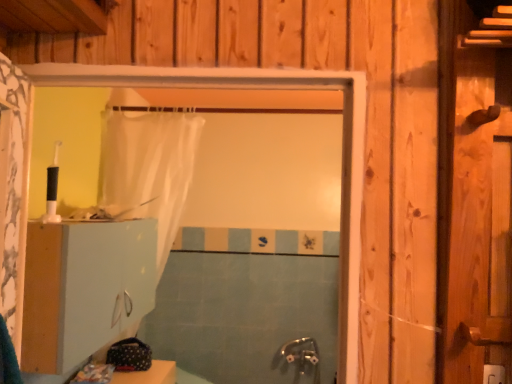
What do you see at coordinates (84, 289) in the screenshot?
I see `white matte cabinet at lower left` at bounding box center [84, 289].

What is the approximate height of white matte cabinet at lower left?

It is 16.42 inches.

Identify the location of translucent white shower curtain at center. (149, 169).

Looking at this image, is blue tile bath at center positioned before white matte cabinet at lower left?

No.

In order to click on dresser in front of the blue tile bath at center in this screenshot , I will do `click(84, 289)`.

Which of these two, blue tile bath at center or white matte cabinet at lower left, is bigger?

white matte cabinet at lower left.

Does point (298, 333) come in front of point (34, 227)?

No, it is not.

Which object is further away from the camera, blue tile bath at center or translucent white shower curtain at center?

blue tile bath at center is further from the camera.

Is blue tile bath at center at the right side of translucent white shower curtain at center?

Yes, blue tile bath at center is to the right of translucent white shower curtain at center.

Who is bigger, blue tile bath at center or translucent white shower curtain at center?

With larger size is translucent white shower curtain at center.

Considering the relative sizes of blue tile bath at center and translucent white shower curtain at center in the image provided, is blue tile bath at center shorter than translucent white shower curtain at center?

Correct, blue tile bath at center is not as tall as translucent white shower curtain at center.

Between translucent white shower curtain at center and white matte cabinet at lower left, which one has smaller width?

Thinner between the two is white matte cabinet at lower left.

From a real-world perspective, is translucent white shower curtain at center above or below white matte cabinet at lower left?

In terms of real-world spatial position, translucent white shower curtain at center is above white matte cabinet at lower left.

Can you confirm if translucent white shower curtain at center is positioned to the right of white matte cabinet at lower left?

Yes.

Considering the relative positions of translucent white shower curtain at center and white matte cabinet at lower left in the image provided, is translucent white shower curtain at center behind white matte cabinet at lower left?

Yes, it is behind white matte cabinet at lower left.

Does translucent white shower curtain at center appear on the left side of blue tile bath at center?

Yes, translucent white shower curtain at center is to the left of blue tile bath at center.

From a real-world perspective, is translucent white shower curtain at center physically above blue tile bath at center?

Yes.

From the image's perspective, which one is positioned higher, white matte cabinet at lower left or translucent white shower curtain at center?

white matte cabinet at lower left is shown above in the image.

Is white matte cabinet at lower left thinner than translucent white shower curtain at center?

Yes, white matte cabinet at lower left is thinner than translucent white shower curtain at center.

In the scene shown: Which object is positioned more to the right, white matte cabinet at lower left or translucent white shower curtain at center?

translucent white shower curtain at center is more to the right.

Are white matte cabinet at lower left and translucent white shower curtain at center far apart?

white matte cabinet at lower left is near translucent white shower curtain at center, not far away.

Based on the photo, from the image's perspective, is white matte cabinet at lower left on top of blue tile bath at center?

Yes.

Based on their sizes in the image, would you say white matte cabinet at lower left is bigger or smaller than blue tile bath at center?

Clearly, white matte cabinet at lower left is larger in size than blue tile bath at center.

Is the depth of white matte cabinet at lower left greater than that of blue tile bath at center?

That is False.

From a real-world perspective, is white matte cabinet at lower left physically located above or below blue tile bath at center?

white matte cabinet at lower left is above blue tile bath at center.

Image resolution: width=512 pixels, height=384 pixels. Find the location of `bath located behind the white matte cabinet at lower left`. bath located behind the white matte cabinet at lower left is located at coordinates (244, 315).

Identify the location of bath below the translucent white shower curtain at center (from a real-world perspective). (244, 315).

Looking at this image, considering their positions, is white matte cabinet at lower left positioned further to blue tile bath at center than translucent white shower curtain at center?

white matte cabinet at lower left is further to blue tile bath at center.

Which object lies further to the anchor point white matte cabinet at lower left, translucent white shower curtain at center or blue tile bath at center?

blue tile bath at center is positioned further to the anchor white matte cabinet at lower left.

Looking at the image, which one is located closer to translucent white shower curtain at center, blue tile bath at center or white matte cabinet at lower left?

white matte cabinet at lower left lies closer to translucent white shower curtain at center than the other object.

From the image, which object appears to be nearer to translucent white shower curtain at center, white matte cabinet at lower left or blue tile bath at center?

white matte cabinet at lower left lies closer to translucent white shower curtain at center than the other object.

Looking at the image, which one is located further to white matte cabinet at lower left, blue tile bath at center or translucent white shower curtain at center?

The object further to white matte cabinet at lower left is blue tile bath at center.

From the image, which object appears to be farther from blue tile bath at center, translucent white shower curtain at center or white matte cabinet at lower left?

white matte cabinet at lower left lies further to blue tile bath at center than the other object.

I want to click on shower curtain between white matte cabinet at lower left and blue tile bath at center in the front-back direction, so click(x=149, y=169).